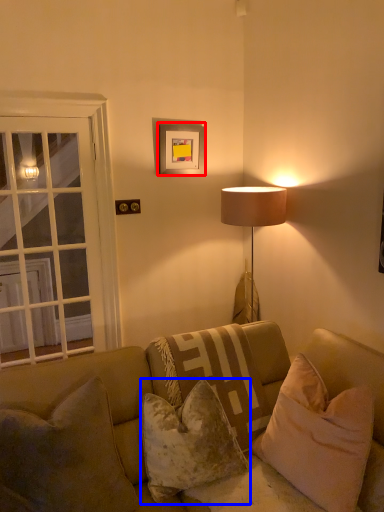
Question: Which point is closer to the camera, picture frame (highlighted by a red box) or pillow (highlighted by a blue box)?

Choices:
 (A) picture frame
 (B) pillow

Answer: (B)